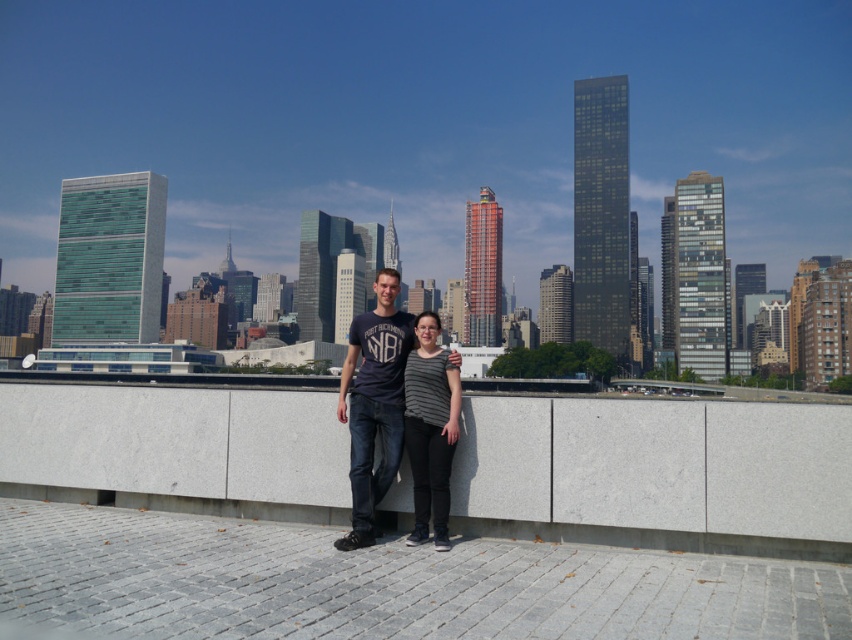
You are a photographer trying to capture a clear shot of the dark blue jeans at center and the striped fabric shirt at center. Which clothing item will appear larger in your photo?

The dark blue jeans at center will appear larger in the photo because it is bigger than the striped fabric shirt at center.

You are a fashion designer observing the urban scene. You notice the dark blue jeans at center and the striped fabric shirt at center. Which clothing item is positioned lower on the person?

The dark blue jeans at center is below striped fabric shirt at center, so the dark blue jeans at center is positioned lower on the person.